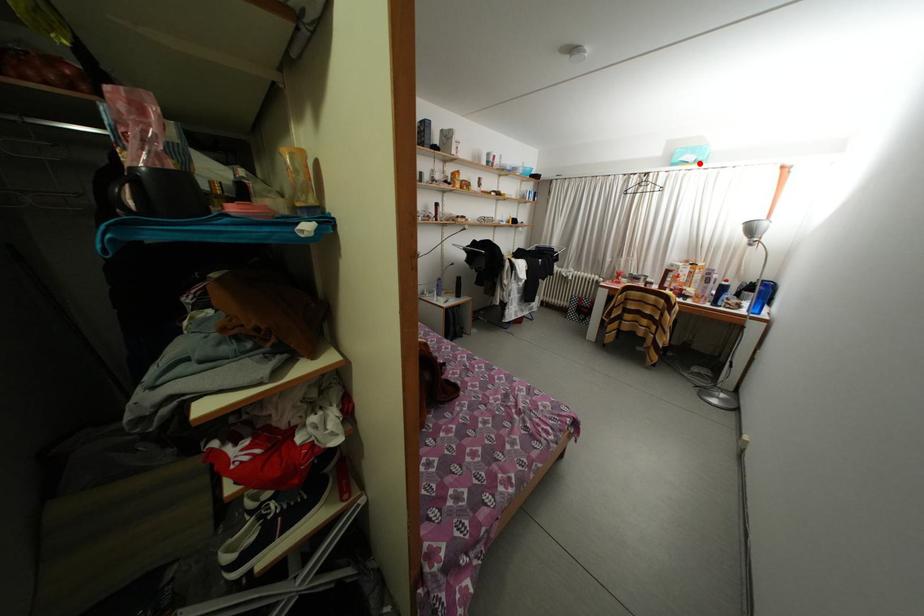
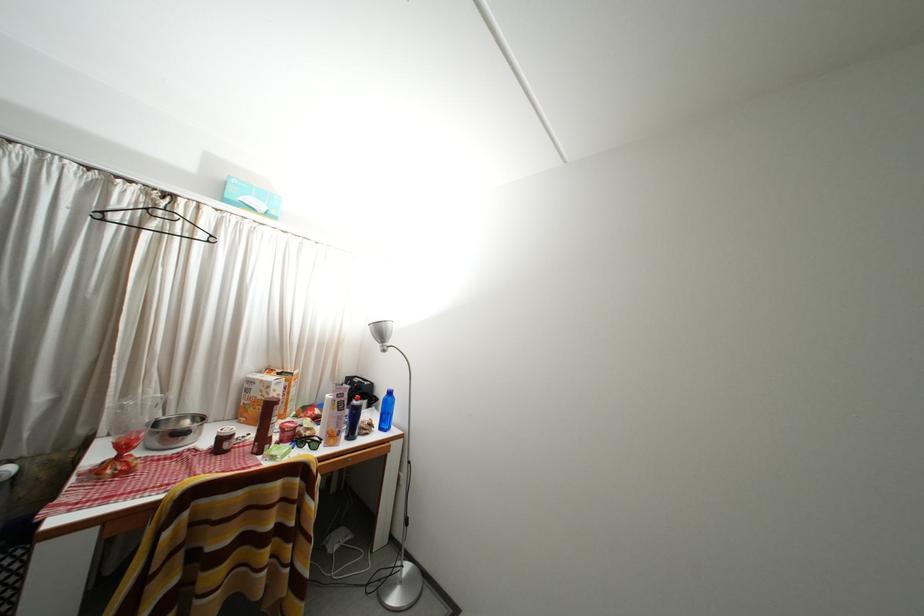
The point at the highlighted location is marked in the first image. Where is the corresponding point in the second image?

(268, 211)